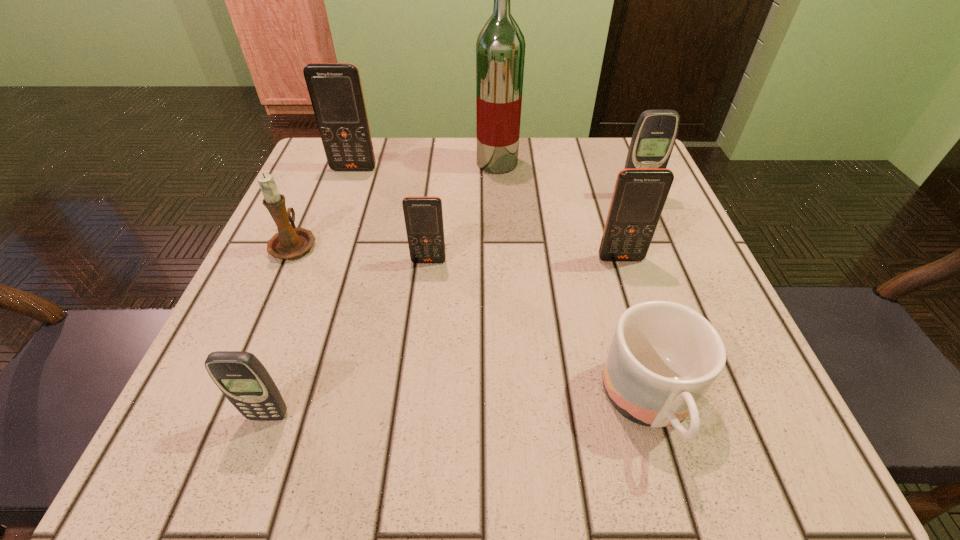
Find the location of a particular element. unoccupied position between the candle holder and the shortest object is located at coordinates (472, 324).

I want to click on vacant point located between the leftmost orange cellular telephone and the second biggest orange cellular telephone, so click(x=488, y=214).

I want to click on empty space between the second farthest cellular telephone and the liquor, so click(x=566, y=179).

This screenshot has height=540, width=960. What are the coordinates of `vacant area that lies between the fourth nearest cellular telephone and the farthest orange cellular telephone` in the screenshot? It's located at tap(495, 182).

Locate an element on the screen. free space between the smallest orange cellular telephone and the candle holder is located at coordinates (362, 252).

At what (x,y) coordinates should I click in order to perform the action: click on the fourth closest object to the blue mug. Please return your answer as a coordinate pair (x, y). The width and height of the screenshot is (960, 540). Looking at the image, I should click on (242, 378).

This screenshot has height=540, width=960. Identify the location of object that is the second closest one to the third cellular telephone from left to right. (639, 196).

This screenshot has width=960, height=540. Identify the location of cellular telephone that is the closest to the second orange cellular telephone from right to left. (639, 196).

Find the location of `cellular telephone that stands as the closest to the nearest cellular telephone`. cellular telephone that stands as the closest to the nearest cellular telephone is located at coordinates (423, 216).

Locate which orange cellular telephone is the second closest to the second biggest orange cellular telephone. Please provide its 2D coordinates. Your answer should be formatted as a tuple, i.e. [(x, y)], where the tuple contains the x and y coordinates of a point satisfying the conditions above.

[(335, 90)]